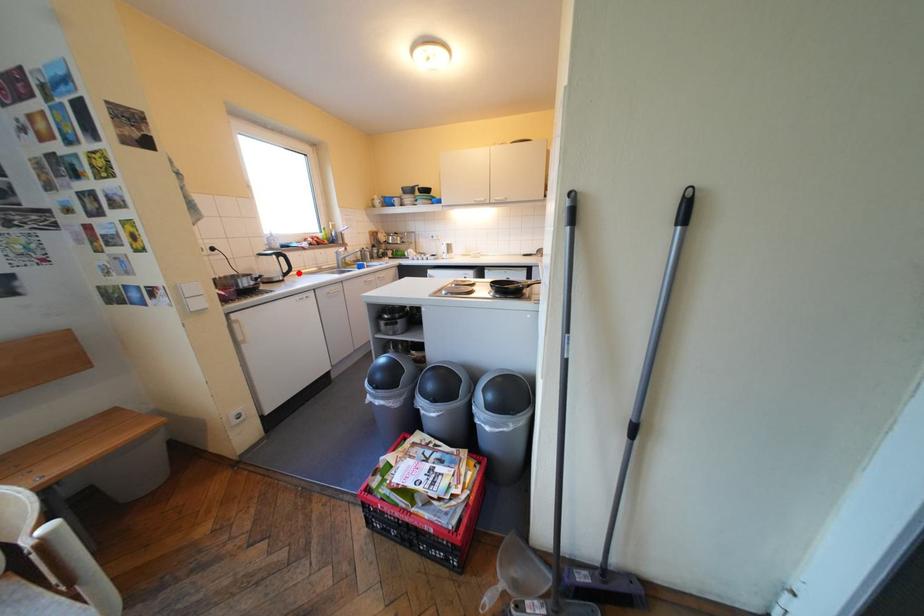
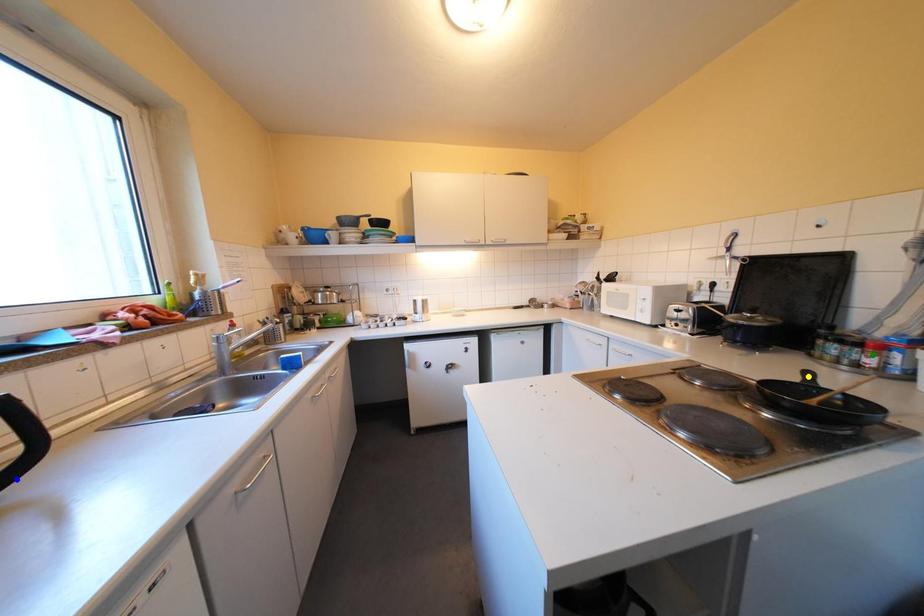
Question: I am providing you with two images of the same scene from different viewpoints. A red point is marked on the first image. You are given multiple points on the second image. Can you choose the point in image 2 that corresponds to the point in image 1?

Choices:
 (A) green point
 (B) blue point
 (C) yellow point

Answer: (B)